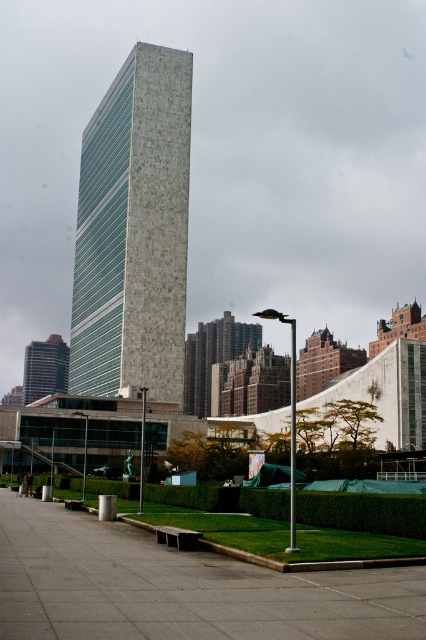
Is gray concrete pavement at lower center in front of white stone tower at center?

Yes, it is in front of white stone tower at center.

Is gray concrete pavement at lower center further to the viewer compared to white stone tower at center?

No, it is not.

This screenshot has height=640, width=426. I want to click on gray concrete pavement at lower center, so click(180, 588).

Is gray concrete pavement at lower center closer to the viewer compared to dark gray stone building at lower left?

Yes, gray concrete pavement at lower center is in front of dark gray stone building at lower left.

Who is lower down, gray concrete pavement at lower center or dark gray stone building at lower left?

Positioned lower is dark gray stone building at lower left.

Where is `gray concrete pavement at lower center`? gray concrete pavement at lower center is located at coordinates (180, 588).

Does white stone tower at center have a smaller size compared to dark gray stone building at lower left?

No.

Is white stone tower at center shorter than dark gray stone building at lower left?

No.

I want to click on white stone tower at center, so click(134, 230).

Locate an element on the screen. The image size is (426, 640). white stone tower at center is located at coordinates (134, 230).